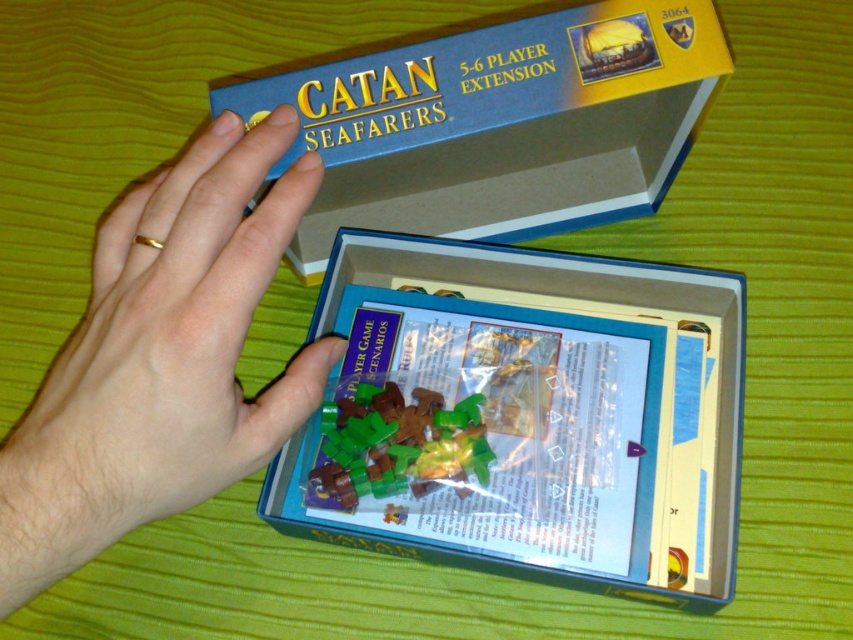
You are organizing the contents of the Catan game box. You need to place the translucent plastic bag at center and the gold metallic ring at upper left. According to the current arrangement, where should you position them relative to each other?

→ The translucent plastic bag at center should be placed below the gold metallic ring at upper left as per the current arrangement.

You are organizing the game pieces and notice the translucent plastic bag at center and the green plastic pieces at center. Which object is wider?

The translucent plastic bag at center is wider than the green plastic pieces at center.

You are designing a digital version of the Catan board game and need to place a new decorative element. The gold metallic ring at upper left is located at coordinates 0.547, 0.197. Where should you place it in the digital interface relative to the original position?

The gold metallic ring at upper left should be placed at coordinates [167,349] in the digital interface to match its original position.